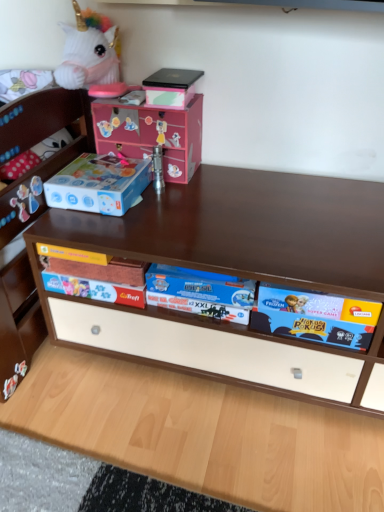
At what (x,y) coordinates should I click in order to perform the action: click on vacant space to the right of blue cardboard storage box at left. Please return your answer as a coordinate pair (x, y). Looking at the image, I should click on pos(174,207).